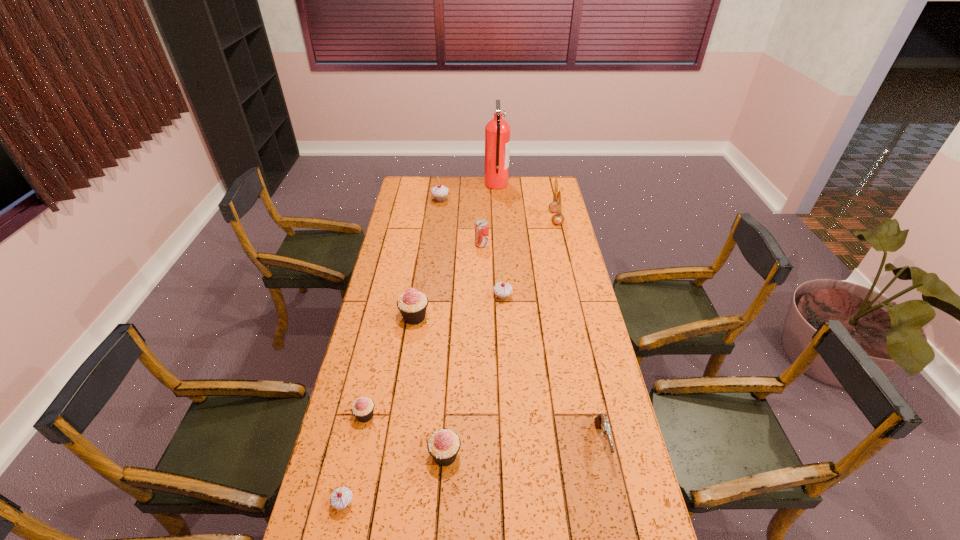
Identify the location of vacant space at the far left corner of the desktop. The width and height of the screenshot is (960, 540). (419, 179).

Find the location of a particular element. This screenshot has height=540, width=960. free space at the far right corner of the desktop is located at coordinates (538, 197).

At what (x,y) coordinates should I click in order to perform the action: click on free spot between the farthest pink cupcake and the pink soda can. Please return your answer as a coordinate pair (x, y). The height and width of the screenshot is (540, 960). Looking at the image, I should click on (448, 281).

Locate an element on the screen. Image resolution: width=960 pixels, height=540 pixels. free space between the third nearest cupcake and the gray pistol is located at coordinates (484, 429).

The width and height of the screenshot is (960, 540). Identify the location of free space between the fifth nearest cupcake and the eighth nearest object. (529, 258).

Image resolution: width=960 pixels, height=540 pixels. I want to click on vacant space that's between the gray pistol and the smallest pink cupcake, so click(484, 429).

Image resolution: width=960 pixels, height=540 pixels. I want to click on vacant point located between the soda can and the fourth nearest cupcake, so click(x=448, y=281).

The height and width of the screenshot is (540, 960). What are the coordinates of `vacant space that is in between the nearest pink cupcake and the tallest object` in the screenshot? It's located at (470, 320).

Where is `free space that is in between the gray pistol and the second nearest cupcake`? free space that is in between the gray pistol and the second nearest cupcake is located at coordinates (523, 449).

In order to click on vacant point located between the nearest cupcake and the farthest gray cupcake in this screenshot , I will do `click(392, 352)`.